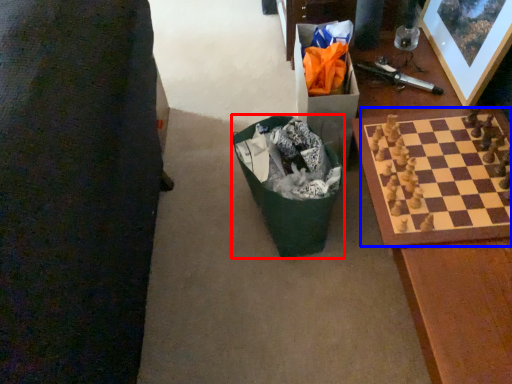
Question: Which object is further to the camera taking this photo, recycling bin (highlighted by a red box) or board game (highlighted by a blue box)?

Choices:
 (A) recycling bin
 (B) board game

Answer: (A)